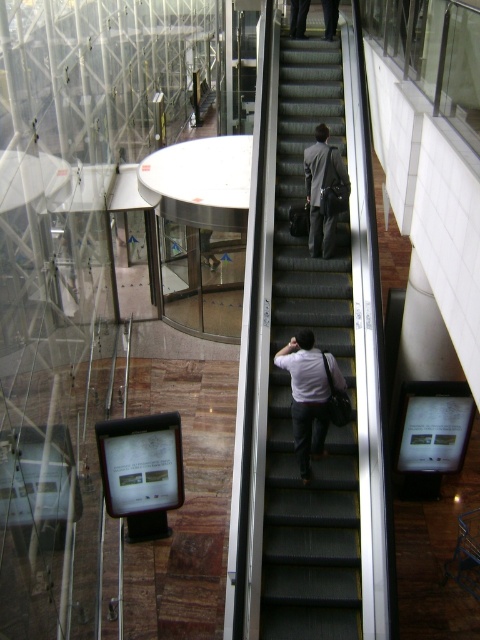
You are a person standing at the bottom of the escalator and want to reach the gray suit at center. Which direction should you move relative to the black carpeted stairs at center?

The black carpeted stairs at center is located below the gray suit at center, so to reach the gray suit at center, you should move upward away from the black carpeted stairs at center.

You are standing on the white matte shirt at center and want to reach the black carpeted stairs at center. Which direction should you move to ascend?

The black carpeted stairs at center is above the white matte shirt at center, so you should move upward to reach them.

You are standing at the bottom of the escalator and want to reach the top floor quickly. The black carpeted stairs at center and gray suit at center are in your path. Which one should you avoid stepping on to reach the top floor?

The black carpeted stairs at center is taller than gray suit at center, so you should avoid stepping on the black carpeted stairs at center to reach the top floor quickly.